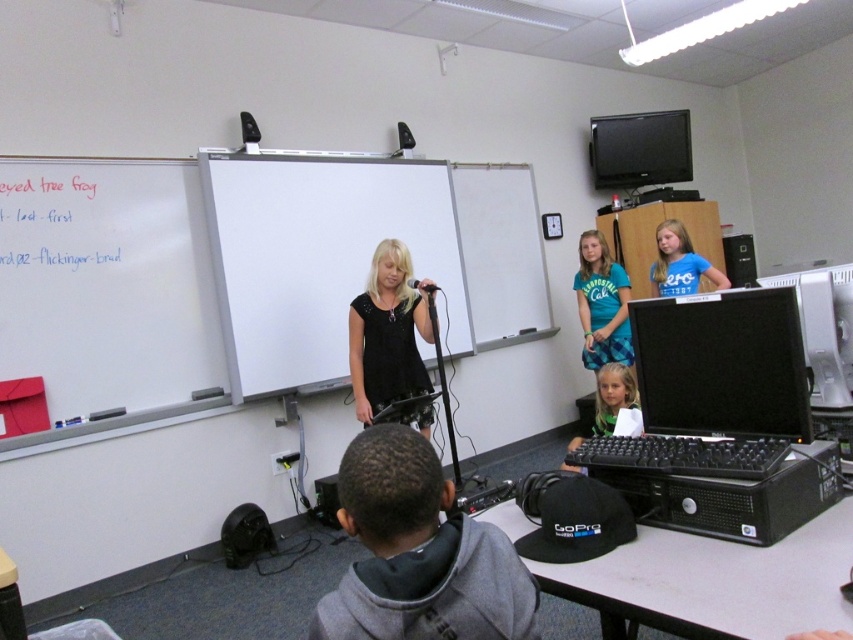
Question: Among these objects, which one is farthest from the camera?

Choices:
 (A) matte black keyboard at lower center
 (B) blue plaid dress at center
 (C) black matte dress at center

Answer: (B)

Question: Is white plastic computer at right thinner than blue t-shirt at upper right?

Choices:
 (A) yes
 (B) no

Answer: (A)

Question: Does white plastic computer at right appear on the left side of blue t-shirt at upper right?

Choices:
 (A) yes
 (B) no

Answer: (A)

Question: Is black matte dress at center below white plastic computer at right?

Choices:
 (A) yes
 (B) no

Answer: (A)

Question: Which point is closer to the camera taking this photo?

Choices:
 (A) (833, 401)
 (B) (692, 288)
 (C) (426, 413)

Answer: (A)

Question: Estimate the real-world distances between objects in this image. Which object is farther from the white plastic computer at right?

Choices:
 (A) blue plaid dress at center
 (B) matte black keyboard at lower center

Answer: (A)